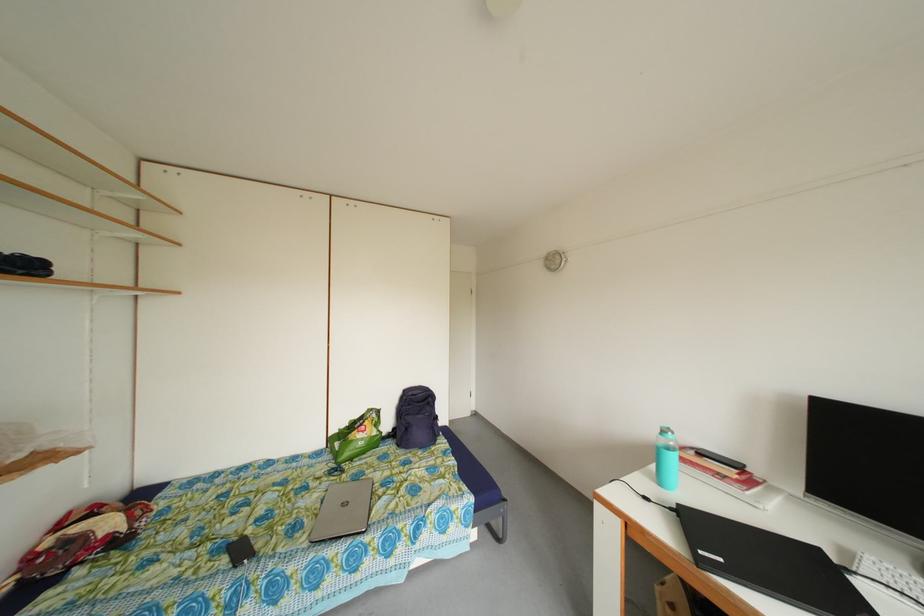
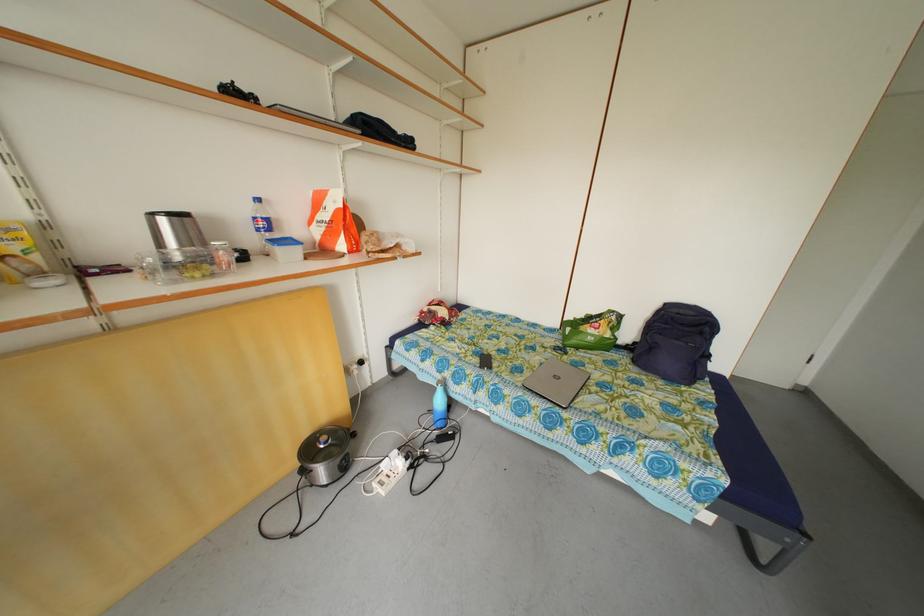
Find the pixel in the second image that matches point 314,523 in the first image.

(535, 374)